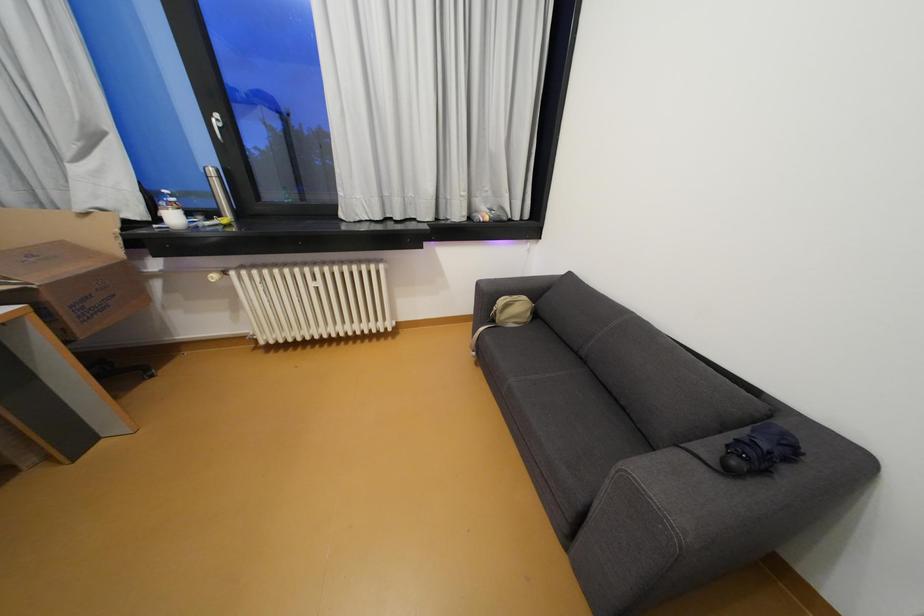
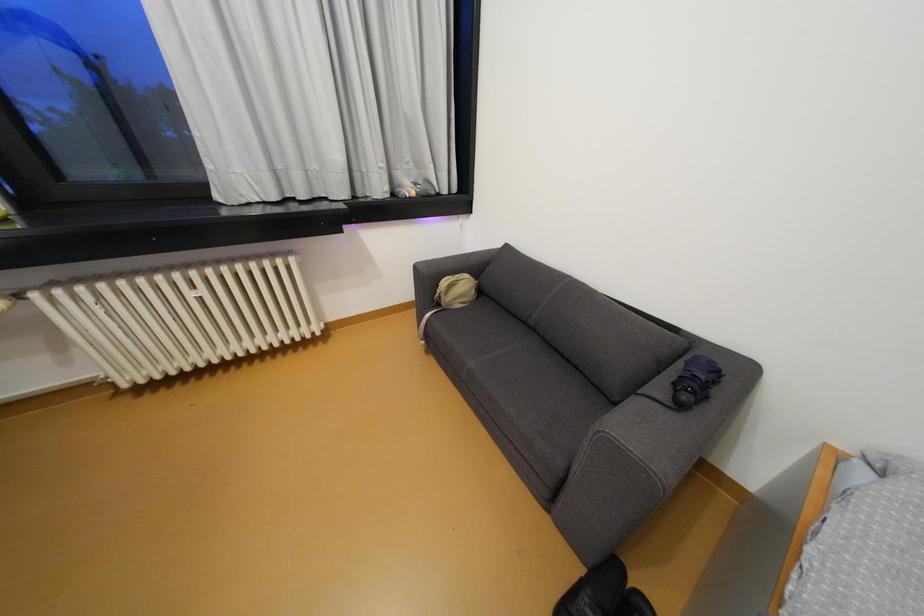
Question: The images are taken continuously from a first-person perspective. In which direction is your viewpoint rotating?

Choices:
 (A) Left
 (B) Right
 (C) Up
 (D) Down

Answer: (B)